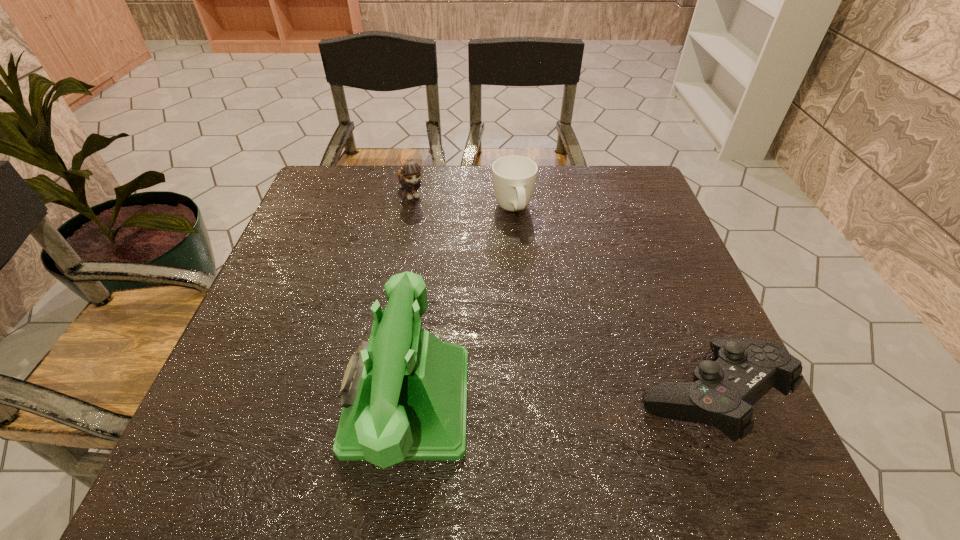
Where is `the tallest object`? The width and height of the screenshot is (960, 540). the tallest object is located at coordinates click(404, 393).

Where is `the rightmost object`? The width and height of the screenshot is (960, 540). the rightmost object is located at coordinates (722, 393).

This screenshot has height=540, width=960. I want to click on kitten, so click(409, 176).

Where is `cup`? The width and height of the screenshot is (960, 540). cup is located at coordinates (514, 177).

This screenshot has width=960, height=540. Find the location of `free location located on the dial of the tallest object`. free location located on the dial of the tallest object is located at coordinates (273, 401).

Find the location of a particular element. vacant region located on the dial of the tallest object is located at coordinates (300, 401).

You are a GUI agent. You are given a task and a screenshot of the screen. Output one action in this format:
    pyautogui.click(x=<x>, y=<y>)
    Task: Click on the free space located on the dial of the tallest object
    
    Given the screenshot: What is the action you would take?
    pyautogui.click(x=300, y=401)

Where is `vacant space located on the left of the control`? Image resolution: width=960 pixels, height=540 pixels. vacant space located on the left of the control is located at coordinates (471, 397).

Locate an element on the screen. The height and width of the screenshot is (540, 960). vacant space located 0.230m on the front-facing side of the kitten is located at coordinates (443, 260).

Where is `blank space located on the front-facing side of the kitten`? blank space located on the front-facing side of the kitten is located at coordinates (450, 277).